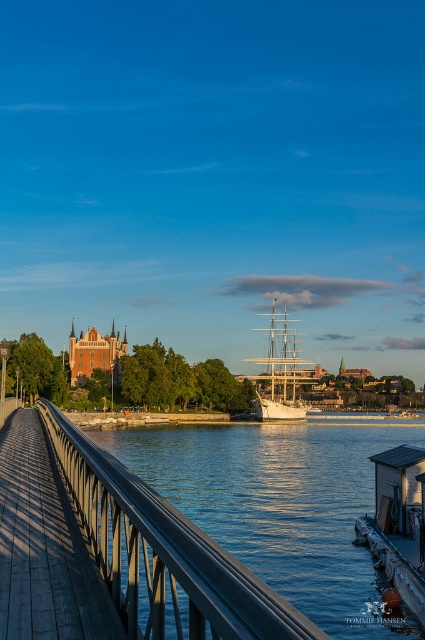
Who is more distant from viewer, [227,612] or [277,408]?

The point [277,408] is more distant.

How distant is metallic gray rail at center from white wooden ship at center?

The distance of metallic gray rail at center from white wooden ship at center is 111.99 meters.

Does point (184, 624) come farther from viewer compared to point (283, 406)?

No, it is not.

The height and width of the screenshot is (640, 425). What are the coordinates of `metallic gray rail at center` in the screenshot? It's located at (164, 554).

Is metallic gray rail at center bigger than wooden dock at left?

Indeed, metallic gray rail at center has a larger size compared to wooden dock at left.

The width and height of the screenshot is (425, 640). What do you see at coordinates (164, 554) in the screenshot?
I see `metallic gray rail at center` at bounding box center [164, 554].

Image resolution: width=425 pixels, height=640 pixels. What are the coordinates of `metallic gray rail at center` in the screenshot? It's located at (164, 554).

Between wooden dock at left and white wooden ship at center, which one appears on the right side from the viewer's perspective?

white wooden ship at center

Who is higher up, wooden dock at left or white wooden ship at center?

white wooden ship at center is higher up.

You are a GUI agent. You are given a task and a screenshot of the screen. Output one action in this format:
    pyautogui.click(x=<x>, y=<y>)
    Task: Click on the wooden dock at left
    Image resolution: width=425 pixels, height=640 pixels.
    Given the screenshot: What is the action you would take?
    pyautogui.click(x=45, y=547)